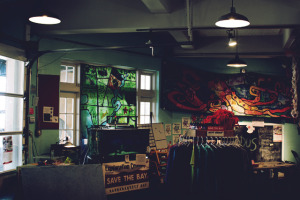
Locate an element on the screen. window is located at coordinates click(x=63, y=114), click(x=145, y=107), click(x=13, y=115).